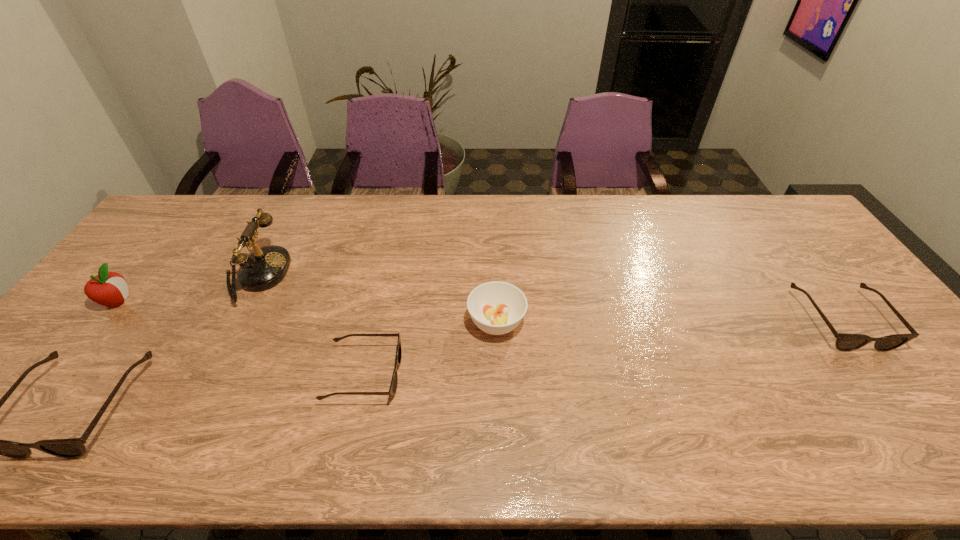
Find the location of a particular element. The width and height of the screenshot is (960, 540). the second sunglasses from left to right is located at coordinates (393, 386).

The height and width of the screenshot is (540, 960). Identify the location of the shortest object. pos(393,386).

This screenshot has width=960, height=540. I want to click on the rightmost sunglasses, so click(844, 342).

Where is `the second tallest sunglasses`? The image size is (960, 540). the second tallest sunglasses is located at coordinates (844, 342).

At what (x,y) coordinates should I click in order to perform the action: click on apple. Please return your answer as a coordinate pair (x, y). Looking at the image, I should click on (107, 288).

Where is `the third object from left to right`? the third object from left to right is located at coordinates (265, 267).

I want to click on the tallest object, so click(x=265, y=267).

Find the location of a particular element. Image resolution: width=960 pixels, height=540 pixels. soup bowl is located at coordinates (496, 308).

You are a GUI agent. You are given a task and a screenshot of the screen. Output one action in this format:
    pyautogui.click(x=<x>, y=<y>)
    Task: Click on the free region located 0.220m on the front lenses of the shortest sunglasses
    The height and width of the screenshot is (540, 960).
    Given the screenshot: What is the action you would take?
    pyautogui.click(x=490, y=374)

Where is `vacant space located 0.120m on the front lenses of the rightmost sunglasses`? The width and height of the screenshot is (960, 540). vacant space located 0.120m on the front lenses of the rightmost sunglasses is located at coordinates (896, 394).